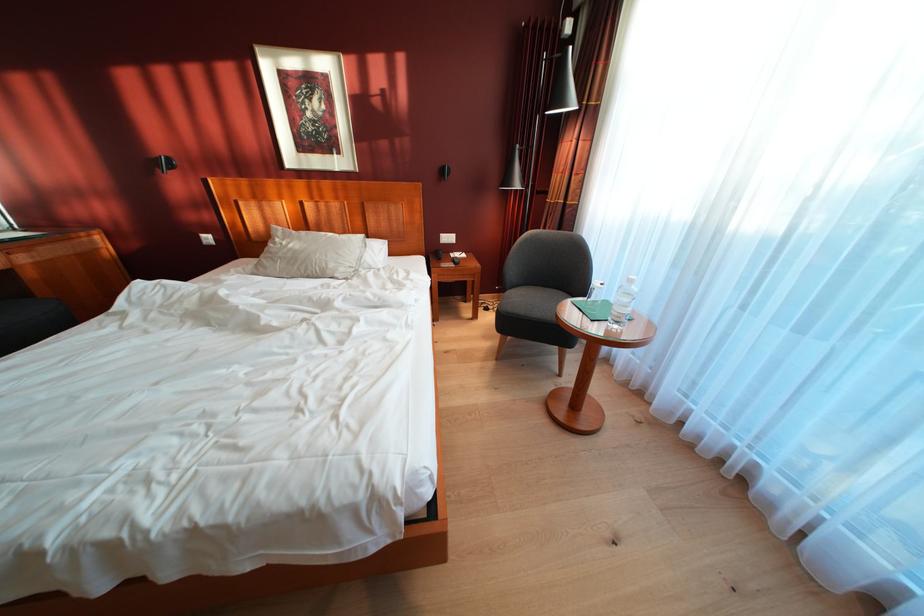
I want to click on white pillow, so click(x=310, y=254).